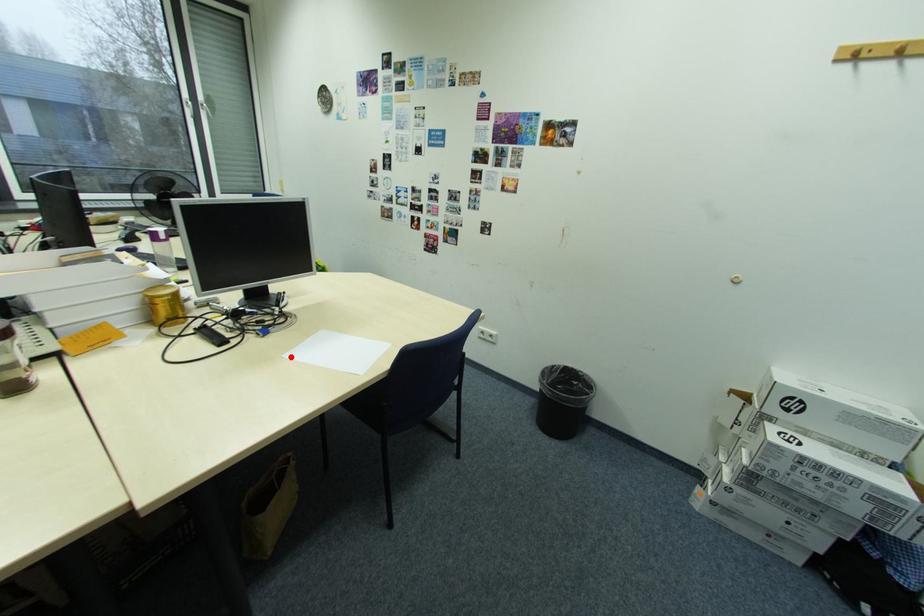
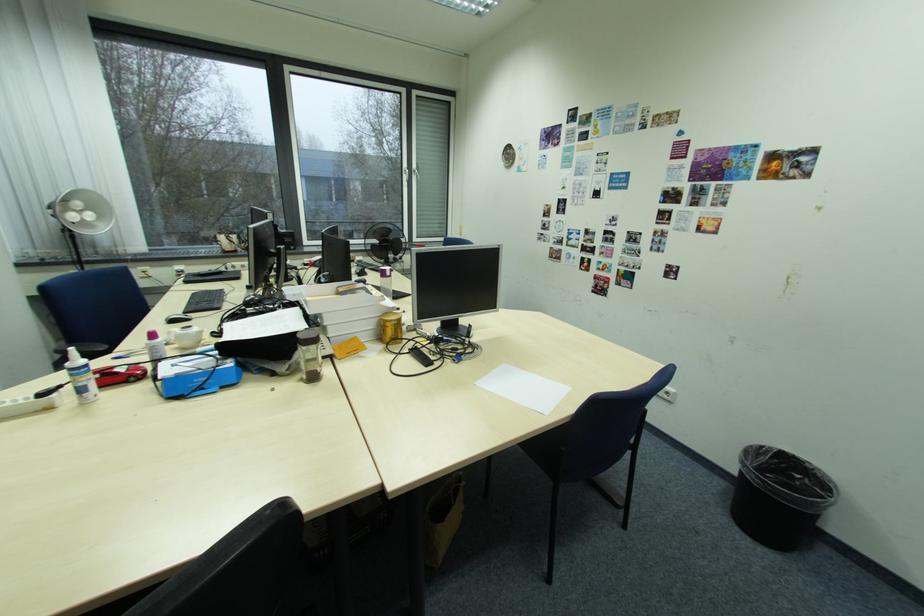
Where in the second image is the point corresponding to the highlighted location from the first image?

(482, 384)